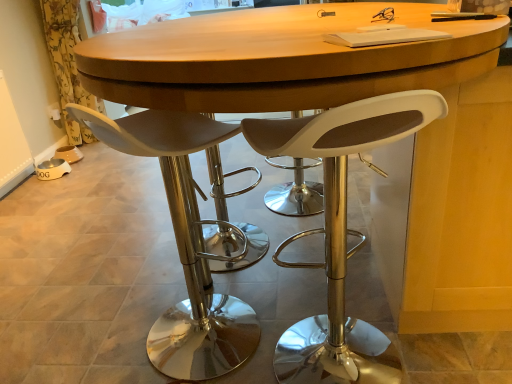
Locate an element on the screen. This screenshot has height=384, width=512. free space to the back side of white matte stool at center, arranged as the first chair when viewed from the left is located at coordinates (185, 286).